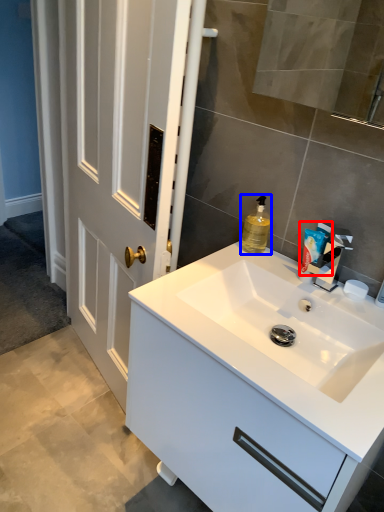
Question: Which of the following is the farthest to the observer, toiletry (highlighted by a red box) or cleaning product (highlighted by a blue box)?

Choices:
 (A) toiletry
 (B) cleaning product

Answer: (B)